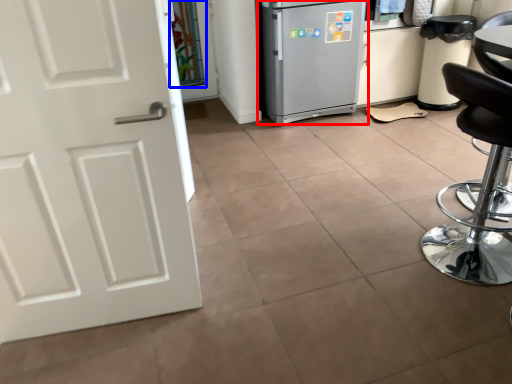
Question: Among these objects, which one is farthest to the camera, refrigerator (highlighted by a red box) or glass door (highlighted by a blue box)?

Choices:
 (A) refrigerator
 (B) glass door

Answer: (B)